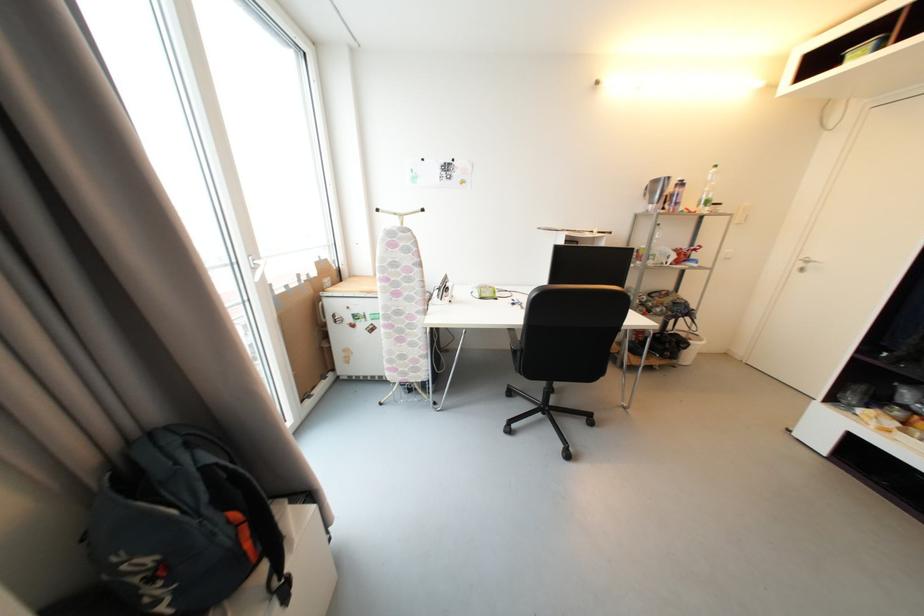
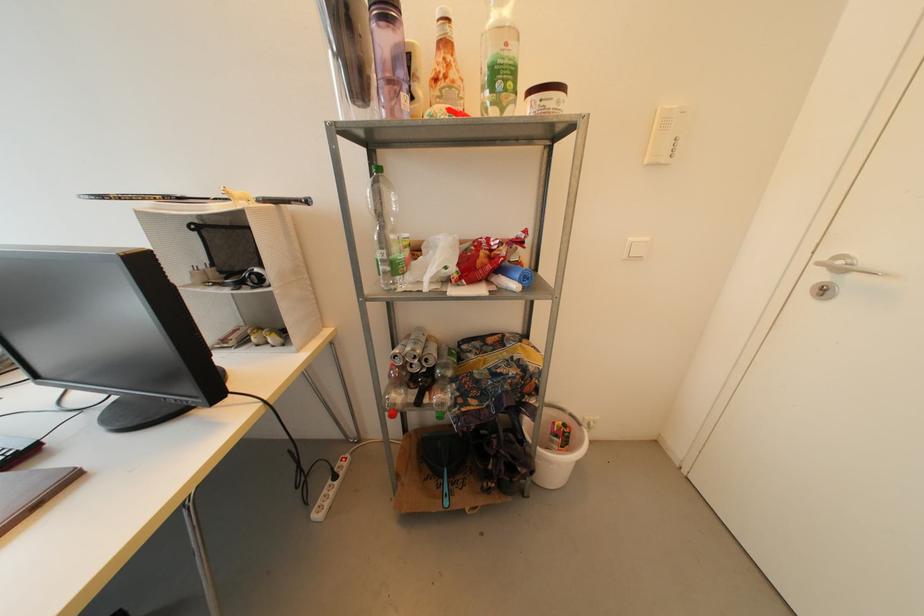
The images are taken continuously from a first-person perspective. In which direction are you moving?

The cameraman walked toward right, forward.